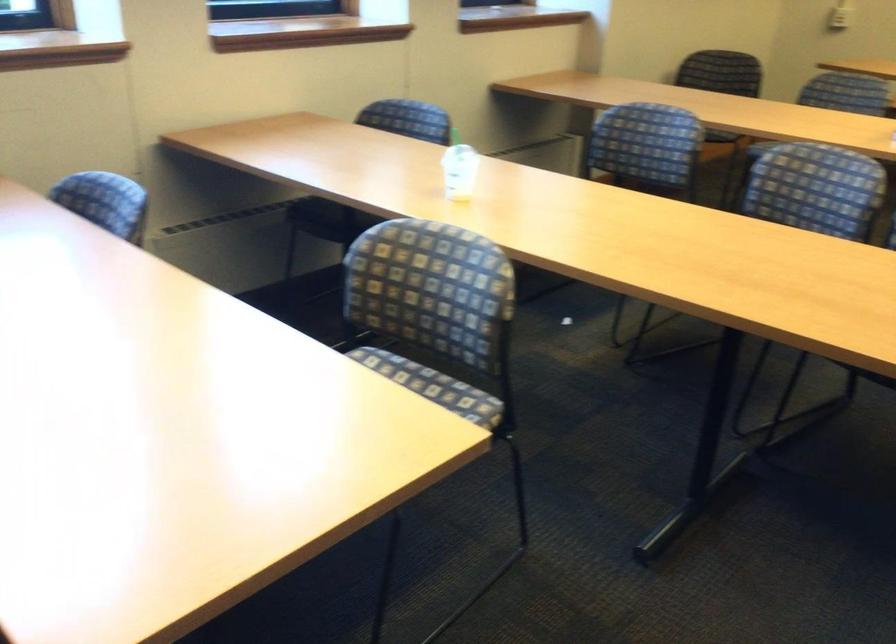
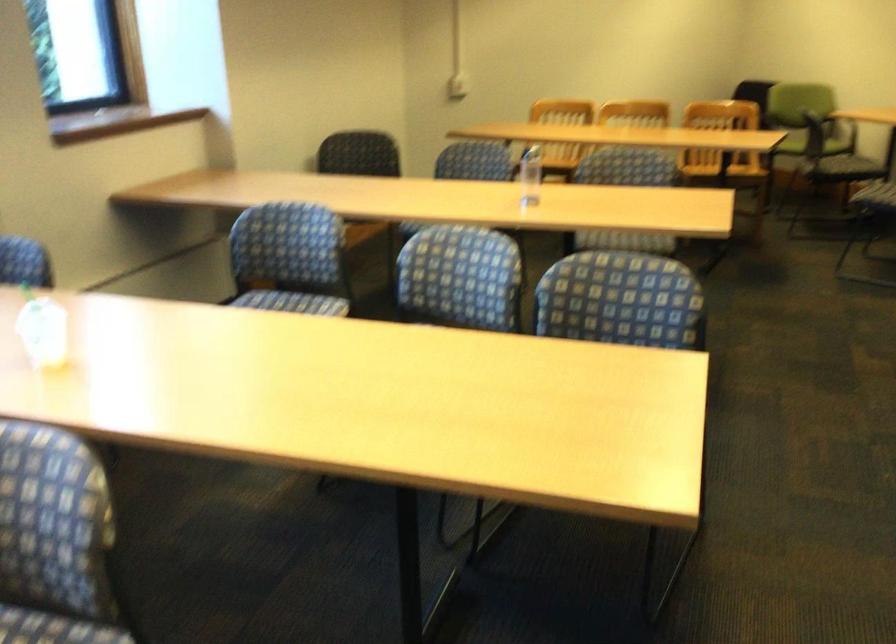
In the second image, find the point that corresponds to point (640, 152) in the first image.

(289, 259)